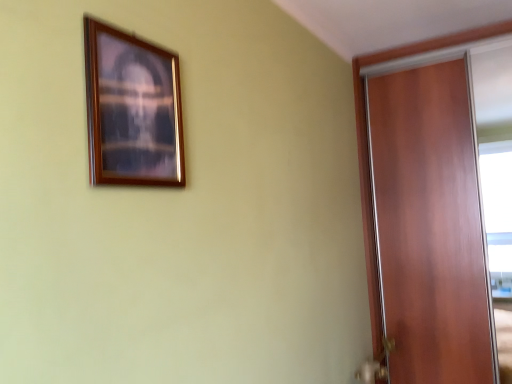
Question: Is wooden door at right thinner than wooden picture frame at upper left?

Choices:
 (A) no
 (B) yes

Answer: (A)

Question: Is wooden door at right bigger than wooden picture frame at upper left?

Choices:
 (A) yes
 (B) no

Answer: (A)

Question: From the image's perspective, is wooden door at right under wooden picture frame at upper left?

Choices:
 (A) no
 (B) yes

Answer: (B)

Question: Considering the relative positions of wooden door at right and wooden picture frame at upper left in the image provided, is wooden door at right to the left of wooden picture frame at upper left from the viewer's perspective?

Choices:
 (A) yes
 (B) no

Answer: (B)

Question: From a real-world perspective, is wooden door at right beneath wooden picture frame at upper left?

Choices:
 (A) yes
 (B) no

Answer: (A)

Question: Looking at their shapes, would you say gold metallic door handle at lower right is wider or thinner than wooden picture frame at upper left?

Choices:
 (A) wide
 (B) thin

Answer: (A)

Question: Is gold metallic door handle at lower right bigger or smaller than wooden picture frame at upper left?

Choices:
 (A) big
 (B) small

Answer: (A)

Question: From the image's perspective, is gold metallic door handle at lower right above or below wooden picture frame at upper left?

Choices:
 (A) above
 (B) below

Answer: (B)

Question: Based on their positions, is gold metallic door handle at lower right located to the left or right of wooden picture frame at upper left?

Choices:
 (A) right
 (B) left

Answer: (A)

Question: Considering the positions of wooden door at right and wooden picture frame at upper left in the image, is wooden door at right wider or thinner than wooden picture frame at upper left?

Choices:
 (A) wide
 (B) thin

Answer: (A)

Question: In terms of height, does wooden door at right look taller or shorter compared to wooden picture frame at upper left?

Choices:
 (A) tall
 (B) short

Answer: (A)

Question: From a real-world perspective, is wooden door at right above or below wooden picture frame at upper left?

Choices:
 (A) above
 (B) below

Answer: (B)

Question: Looking at the image, does wooden door at right seem bigger or smaller compared to wooden picture frame at upper left?

Choices:
 (A) small
 (B) big

Answer: (B)

Question: In the image, is gold metallic door handle at lower right positioned in front of or behind wooden door at right?

Choices:
 (A) behind
 (B) front

Answer: (B)

Question: From a real-world perspective, relative to wooden door at right, is gold metallic door handle at lower right vertically above or below?

Choices:
 (A) above
 (B) below

Answer: (B)